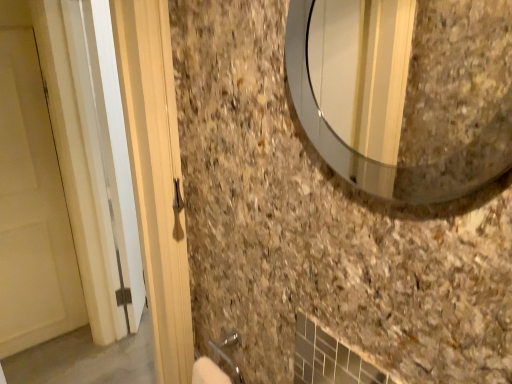
Question: Considering the relative sizes of white matte door at left and clear glass mirror at upper right in the image provided, is white matte door at left taller than clear glass mirror at upper right?

Choices:
 (A) yes
 (B) no

Answer: (A)

Question: Is white matte door at left at the left side of clear glass mirror at upper right?

Choices:
 (A) no
 (B) yes

Answer: (B)

Question: Would you say white matte door at left is outside clear glass mirror at upper right?

Choices:
 (A) no
 (B) yes

Answer: (B)

Question: From a real-world perspective, is white matte door at left under clear glass mirror at upper right?

Choices:
 (A) no
 (B) yes

Answer: (B)

Question: Does white matte door at left have a smaller size compared to clear glass mirror at upper right?

Choices:
 (A) yes
 (B) no

Answer: (B)

Question: Is clear glass mirror at upper right a part of white matte door at left?

Choices:
 (A) yes
 (B) no

Answer: (B)

Question: Is clear glass mirror at upper right oriented towards white matte door at left?

Choices:
 (A) yes
 (B) no

Answer: (B)

Question: From a real-world perspective, does clear glass mirror at upper right stand above white matte door at left?

Choices:
 (A) yes
 (B) no

Answer: (A)

Question: Is there a large distance between clear glass mirror at upper right and white matte door at left?

Choices:
 (A) no
 (B) yes

Answer: (B)

Question: Is clear glass mirror at upper right closer to the viewer compared to white matte door at left?

Choices:
 (A) no
 (B) yes

Answer: (B)

Question: Is clear glass mirror at upper right bigger than white matte door at left?

Choices:
 (A) yes
 (B) no

Answer: (B)

Question: Considering the relative sizes of clear glass mirror at upper right and white matte door at left in the image provided, is clear glass mirror at upper right taller than white matte door at left?

Choices:
 (A) no
 (B) yes

Answer: (A)

Question: From the image's perspective, is white matte door at left located above or below clear glass mirror at upper right?

Choices:
 (A) below
 (B) above

Answer: (A)